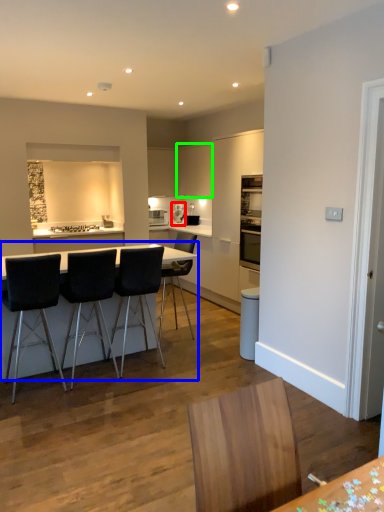
Question: Estimate the real-world distances between objects in this image. Which object is closer to coffee machine (highlighted by a red box), table (highlighted by a blue box) or cabinetry (highlighted by a green box)?

Choices:
 (A) table
 (B) cabinetry

Answer: (B)